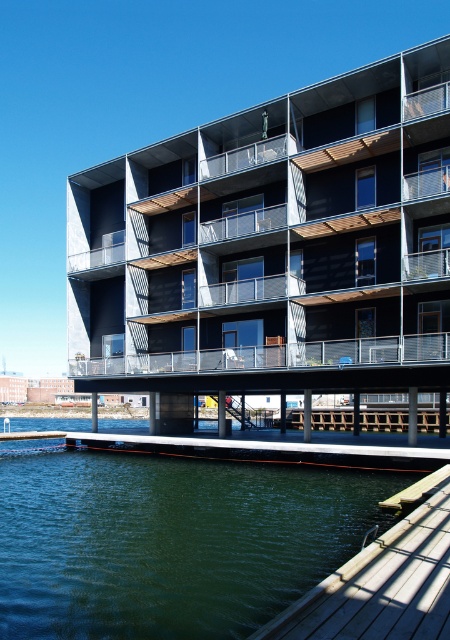
Question: Does wooden dock at lower center lie behind green water at lower left?

Choices:
 (A) no
 (B) yes

Answer: (B)

Question: Can you confirm if wooden dock at lower center is smaller than green water at lower left?

Choices:
 (A) yes
 (B) no

Answer: (B)

Question: Which object is farther from the camera taking this photo?

Choices:
 (A) wooden dock at lower right
 (B) green water at lower left
 (C) wooden dock at lower center

Answer: (C)

Question: Which of the following is the farthest from the observer?

Choices:
 (A) (148, 531)
 (B) (391, 586)
 (C) (442, 364)

Answer: (C)

Question: Does wooden dock at lower center have a lesser width compared to wooden dock at lower right?

Choices:
 (A) no
 (B) yes

Answer: (A)

Question: Which point is farther from the camera taking this photo?

Choices:
 (A) [271, 588]
 (B) [365, 621]
 (C) [243, 250]

Answer: (C)